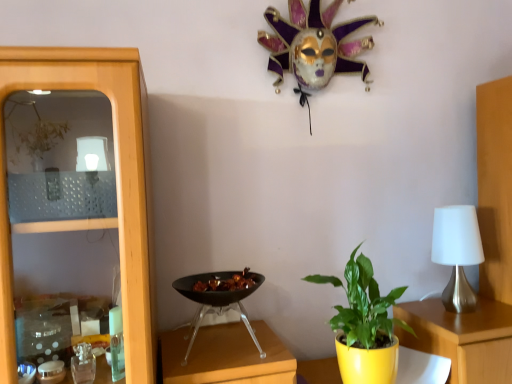
The height and width of the screenshot is (384, 512). What do you see at coordinates (364, 325) in the screenshot?
I see `green glossy leafy plant at center` at bounding box center [364, 325].

Where is `satin silver table lamp at right`? Image resolution: width=512 pixels, height=384 pixels. satin silver table lamp at right is located at coordinates (457, 253).

Does satin silver table lamp at right lie in front of green glossy leafy plant at center?

No, it is not.

In the scene shown: Is satin silver table lamp at right positioned beyond the bounds of green glossy leafy plant at center?

satin silver table lamp at right lies outside green glossy leafy plant at center's area.

Which point is more distant from viewer, (x=472, y=228) or (x=397, y=322)?

The point (x=397, y=322) is more distant.

Does black glossy wok at center touch satin silver table lamp at right?

No, black glossy wok at center is not next to satin silver table lamp at right.

This screenshot has width=512, height=384. Identify the location of table lamp above the black glossy wok at center (from the image's perspective). (457, 253).

Would you say black glossy wok at center is to the left or to the right of satin silver table lamp at right in the picture?

Clearly, black glossy wok at center is on the left of satin silver table lamp at right in the image.

Can you confirm if black glossy wok at center is shorter than satin silver table lamp at right?

Indeed, black glossy wok at center has a lesser height compared to satin silver table lamp at right.

Visually, is satin silver table lamp at right positioned to the left or to the right of black glossy wok at center?

Clearly, satin silver table lamp at right is on the right of black glossy wok at center in the image.

In the scene shown: From a real-world perspective, which is physically below, satin silver table lamp at right or black glossy wok at center?

black glossy wok at center is physically lower.

Which is more distant, (473, 254) or (245, 292)?

Positioned behind is point (473, 254).

Does satin silver table lamp at right touch black glossy wok at center?

satin silver table lamp at right and black glossy wok at center are not in contact.

Which is correct: green glossy leafy plant at center is inside satin silver table lamp at right, or outside of it?

green glossy leafy plant at center is located beyond the bounds of satin silver table lamp at right.

Between green glossy leafy plant at center and satin silver table lamp at right, which one has larger size?

green glossy leafy plant at center.

Can you confirm if green glossy leafy plant at center is positioned to the right of satin silver table lamp at right?

Result: In fact, green glossy leafy plant at center is to the left of satin silver table lamp at right.

From the image's perspective, is black glossy wok at center positioned above or below green glossy leafy plant at center?

black glossy wok at center is above green glossy leafy plant at center.

Can you confirm if black glossy wok at center is positioned to the right of green glossy leafy plant at center?

No.

Is point (250, 331) in front of point (353, 279)?

No, it is behind (353, 279).

From a real-world perspective, which object stands above the other?

black glossy wok at center, from a real-world perspective.

Is green glossy leafy plant at center positioned with its back to black glossy wok at center?

No, green glossy leafy plant at center is not facing away from black glossy wok at center.

Locate an element on the screen. This screenshot has height=384, width=512. houseplant located underneath the black glossy wok at center (from a real-world perspective) is located at coordinates (364, 325).

You are a GUI agent. You are given a task and a screenshot of the screen. Output one action in this format:
    pyautogui.click(x=<x>, y=<y>)
    Task: Click on the houseplant on the left side of satin silver table lamp at right
    
    Given the screenshot: What is the action you would take?
    pyautogui.click(x=364, y=325)

The image size is (512, 384). Identify the location of wok below the satin silver table lamp at right (from the image's perspective). (217, 298).

Based on their spatial positions, is black glossy wok at center or satin silver table lamp at right closer to green glossy leafy plant at center?

Based on the image, black glossy wok at center appears to be nearer to green glossy leafy plant at center.

Estimate the real-world distances between objects in this image. Which object is further from satin silver table lamp at right, black glossy wok at center or green glossy leafy plant at center?

black glossy wok at center.

Looking at the image, which one is located further to black glossy wok at center, green glossy leafy plant at center or satin silver table lamp at right?

Based on the image, satin silver table lamp at right appears to be further to black glossy wok at center.

Based on their spatial positions, is green glossy leafy plant at center or black glossy wok at center closer to satin silver table lamp at right?

Among the two, green glossy leafy plant at center is located nearer to satin silver table lamp at right.

Looking at the image, which one is located further to green glossy leafy plant at center, satin silver table lamp at right or black glossy wok at center?

Based on the image, satin silver table lamp at right appears to be further to green glossy leafy plant at center.

Which object lies further to the anchor point black glossy wok at center, satin silver table lamp at right or green glossy leafy plant at center?

satin silver table lamp at right lies further to black glossy wok at center than the other object.

You are a GUI agent. You are given a task and a screenshot of the screen. Output one action in this format:
    pyautogui.click(x=<x>, y=<y>)
    Task: Click on the houseplant between black glossy wok at center and satin silver table lamp at right from left to right
    The width and height of the screenshot is (512, 384).
    Given the screenshot: What is the action you would take?
    pyautogui.click(x=364, y=325)